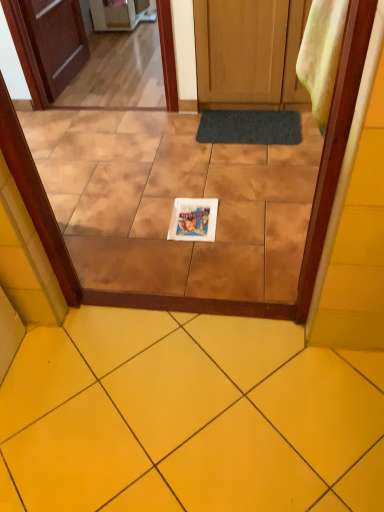
Locate an element on the screen. Image resolution: width=384 pixels, height=512 pixels. vacant space in front of white glossy magazine at center is located at coordinates (197, 256).